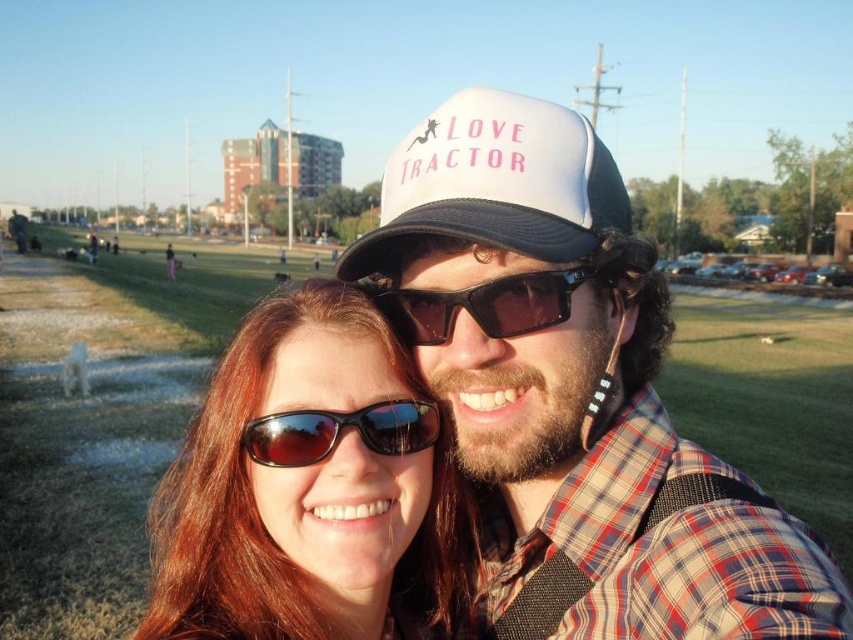
Question: Does white matte baseball cap at center have a lesser width compared to shiny black sunglasses at center?

Choices:
 (A) no
 (B) yes

Answer: (A)

Question: Which is farther from the white mesh cap at center?

Choices:
 (A) white matte baseball cap at center
 (B) black plastic sunglasses at center
 (C) shiny brown hair at center

Answer: (A)

Question: Which of the following is the closest to the observer?

Choices:
 (A) shiny black sunglasses at center
 (B) white mesh cap at center
 (C) white matte baseball cap at center
 (D) shiny brown hair at center

Answer: (B)

Question: Does black plastic sunglasses at center appear on the right side of shiny black sunglasses at center?

Choices:
 (A) no
 (B) yes

Answer: (B)

Question: Which object is positioned closest to the white matte baseball cap at center?

Choices:
 (A) shiny black sunglasses at center
 (B) white mesh cap at center

Answer: (B)

Question: Does shiny brown hair at center appear under white matte baseball cap at center?

Choices:
 (A) no
 (B) yes

Answer: (B)